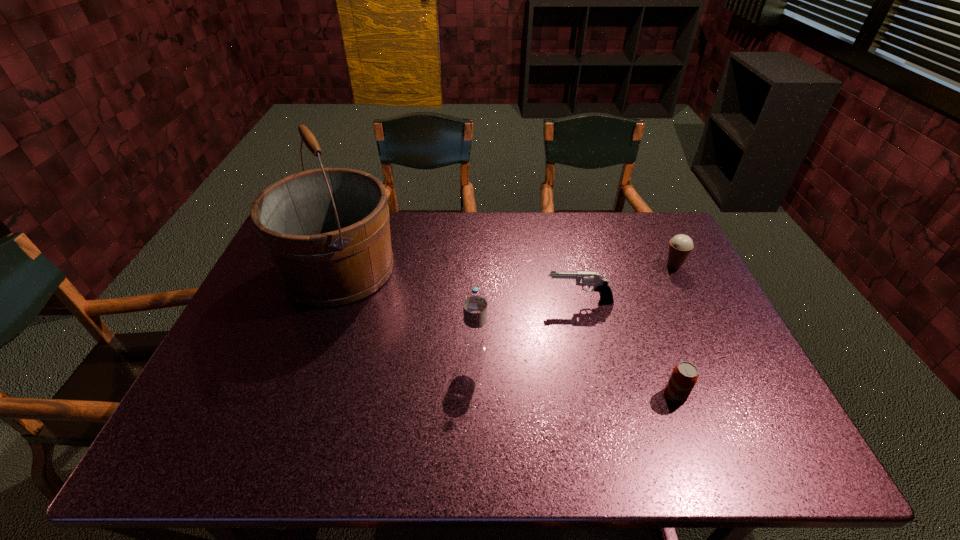
In order to click on vacant space at the near edge in this screenshot , I will do `click(453, 447)`.

Locate an element on the screen. This screenshot has height=540, width=960. vacant space at the left edge of the desktop is located at coordinates pos(266,303).

I want to click on free spot at the right edge of the desktop, so click(x=718, y=323).

Find the location of a particular element. The image size is (960, 540). vacant point at the near left corner is located at coordinates (241, 451).

Where is `vacant space at the far right corner of the desktop`? vacant space at the far right corner of the desktop is located at coordinates (662, 230).

Identify the location of vacant space that is in between the gun and the rightmost object. The width and height of the screenshot is (960, 540). (627, 284).

Locate an element on the screen. This screenshot has height=540, width=960. free space between the icecream and the water bottle is located at coordinates (575, 308).

Where is `free space between the leftmost object and the icecream`? This screenshot has height=540, width=960. free space between the leftmost object and the icecream is located at coordinates (506, 267).

The image size is (960, 540). What are the coordinates of `empty space between the third object from right to left and the icecream` in the screenshot? It's located at (627, 284).

I want to click on free spot between the gun and the leftmost object, so click(459, 285).